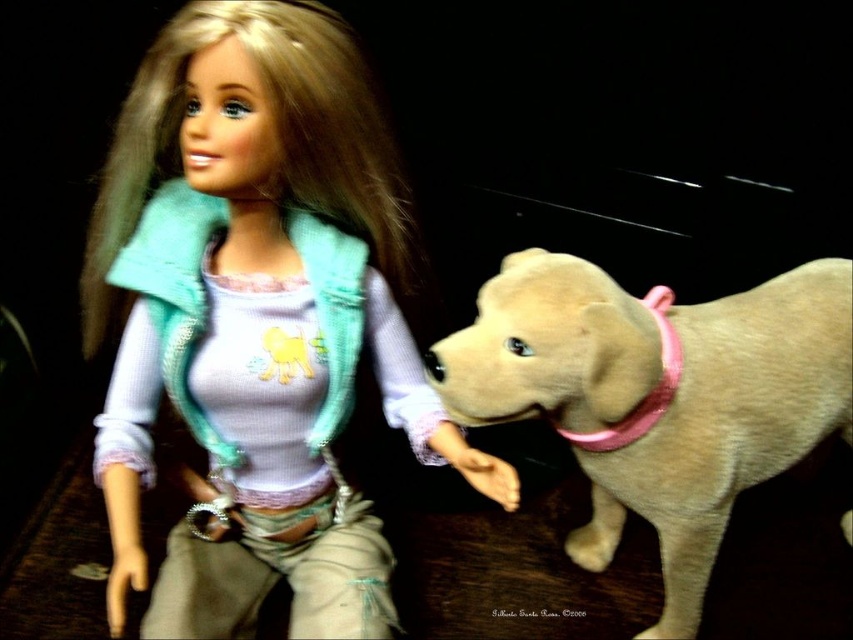
Between point (328, 259) and point (520, 374), which one is positioned behind?

Point (328, 259)

Is matte teal vest at upper left shorter than light beige plush dog at center?

Incorrect, matte teal vest at upper left's height does not fall short of light beige plush dog at center's.

Is point (210, 54) positioned behind point (675, 538)?

No, it is not.

Locate an element on the screen. The height and width of the screenshot is (640, 853). matte teal vest at upper left is located at coordinates (258, 321).